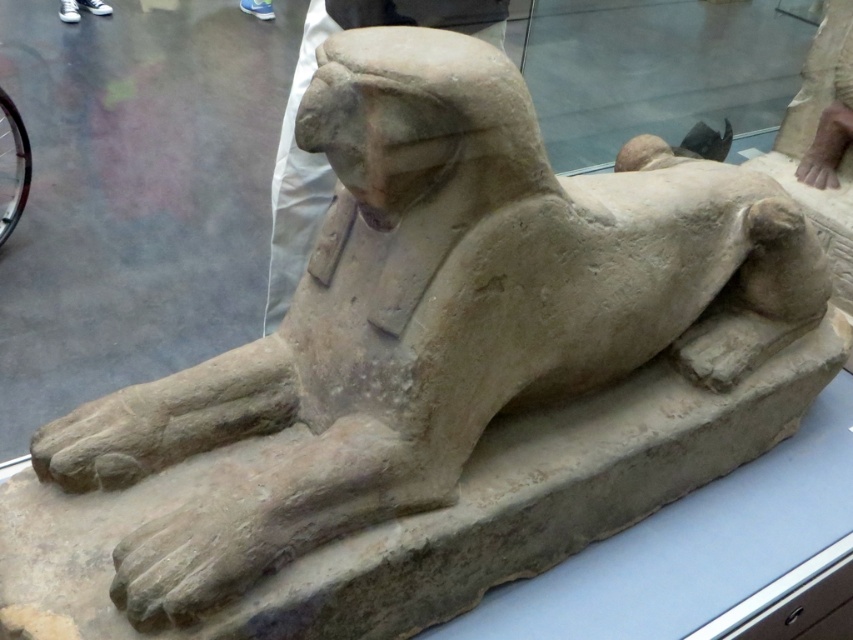
Consider the image. You are standing in front of the glass case containing the stone statue at center and notice your white canvas shoes at upper left. Which object is positioned to the right side from your perspective?

The stone statue at center is to the right of the white canvas shoes at upper left, so the stone statue at center is positioned to the right side from your perspective.

Looking at this image, you are a museum security guard standing at point 0.242, 0.379. You need to check the stone statue at center. Which direction should you move to reach it?

The stone statue at center is located at your current position, so you don already there.